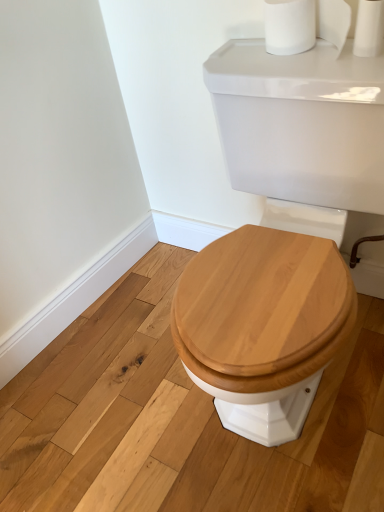
The image size is (384, 512). What do you see at coordinates (369, 28) in the screenshot?
I see `white matte toilet paper at upper right` at bounding box center [369, 28].

Locate an element on the screen. white matte toilet paper at upper right is located at coordinates (369, 28).

Image resolution: width=384 pixels, height=512 pixels. What are the coordinates of `white glossy porcelain at center` in the screenshot? It's located at (302, 130).

This screenshot has height=512, width=384. Describe the element at coordinates (302, 130) in the screenshot. I see `white glossy porcelain at center` at that location.

Where is `white matte toilet paper at upper right`? Image resolution: width=384 pixels, height=512 pixels. white matte toilet paper at upper right is located at coordinates (369, 28).

Based on their positions, is white matte toilet paper at upper right located to the left or right of white glossy porcelain at center?

white matte toilet paper at upper right is to the right of white glossy porcelain at center.

Is white matte toilet paper at upper right further to the viewer compared to white glossy porcelain at center?

Yes, it is.

Which is closer to the camera, (377, 32) or (255, 158)?

Point (377, 32) appears to be closer to the viewer than point (255, 158).

From the image's perspective, is white matte toilet paper at upper right on white glossy porcelain at center?

Yes.

From a real-world perspective, is white matte toilet paper at upper right on top of white glossy porcelain at center?

Indeed, from a real-world perspective, white matte toilet paper at upper right stands above white glossy porcelain at center.

Between white matte toilet paper at upper right and white glossy porcelain at center, which one has smaller width?

Thinner between the two is white matte toilet paper at upper right.

Can you confirm if white matte toilet paper at upper right is shorter than white glossy porcelain at center?

Yes.

Is white matte toilet paper at upper right bigger than white glossy porcelain at center?

No, white matte toilet paper at upper right is not bigger than white glossy porcelain at center.

Is white matte toilet paper at upper right spatially inside white glossy porcelain at center, or outside of it?

white matte toilet paper at upper right cannot be found inside white glossy porcelain at center.

Can you see white matte toilet paper at upper right touching white glossy porcelain at center?

No, white matte toilet paper at upper right is not touching white glossy porcelain at center.

Is white matte toilet paper at upper right oriented away from white glossy porcelain at center?

No, white matte toilet paper at upper right's orientation is not away from white glossy porcelain at center.

Can you tell me how much white matte toilet paper at upper right and white glossy porcelain at center differ in facing direction?

The angular difference between white matte toilet paper at upper right and white glossy porcelain at center is 1.28 degrees.

In order to click on porcelain in front of the white matte toilet paper at upper right in this screenshot , I will do `click(302, 130)`.

Is white glossy porcelain at center to the left or to the right of white matte toilet paper at upper right in the image?

Clearly, white glossy porcelain at center is on the left of white matte toilet paper at upper right in the image.

Who is more distant, white glossy porcelain at center or white matte toilet paper at upper right?

white matte toilet paper at upper right.

Between point (325, 288) and point (381, 35), which one is positioned behind?

The point (381, 35) is farther.

From the picture: From the image's perspective, is white glossy porcelain at center located beneath white matte toilet paper at upper right?

Yes.

From the picture: From a real-world perspective, is white glossy porcelain at center on white matte toilet paper at upper right?

Incorrect, from a real-world perspective, white glossy porcelain at center is lower than white matte toilet paper at upper right.

Considering the sizes of objects white glossy porcelain at center and white matte toilet paper at upper right in the image provided, who is wider, white glossy porcelain at center or white matte toilet paper at upper right?

With larger width is white glossy porcelain at center.

Considering the sizes of objects white glossy porcelain at center and white matte toilet paper at upper right in the image provided, who is taller, white glossy porcelain at center or white matte toilet paper at upper right?

Standing taller between the two is white glossy porcelain at center.

Between white glossy porcelain at center and white matte toilet paper at upper right, which one has smaller size?

With smaller size is white matte toilet paper at upper right.

Would you say white glossy porcelain at center is inside or outside white matte toilet paper at upper right?

white glossy porcelain at center is not enclosed by white matte toilet paper at upper right.

Are white glossy porcelain at center and white matte toilet paper at upper right located far from each other?

No.

Is white glossy porcelain at center oriented away from white matte toilet paper at upper right?

That's not correct — white glossy porcelain at center is not looking away from white matte toilet paper at upper right.

How many degrees apart are the facing directions of white glossy porcelain at center and white matte toilet paper at upper right?

A: The facing directions of white glossy porcelain at center and white matte toilet paper at upper right are 1.28 degrees apart.

In order to click on porcelain in front of the white matte toilet paper at upper right in this screenshot , I will do `click(302, 130)`.

Image resolution: width=384 pixels, height=512 pixels. There is a white glossy porcelain at center. What are the coordinates of `toilet paper above it (from a real-world perspective)` in the screenshot? It's located at (369, 28).

In order to click on porcelain lying in front of the white matte toilet paper at upper right in this screenshot , I will do `click(302, 130)`.